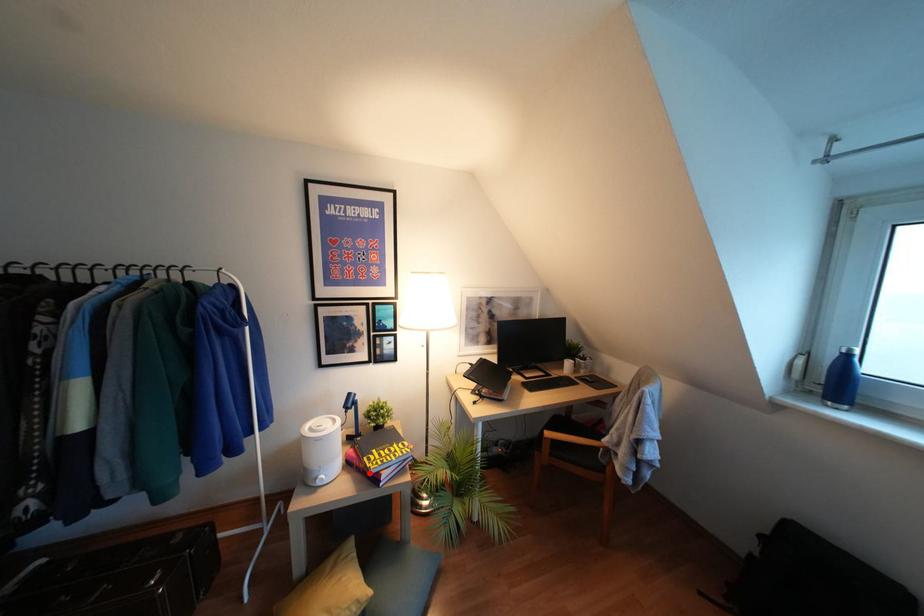
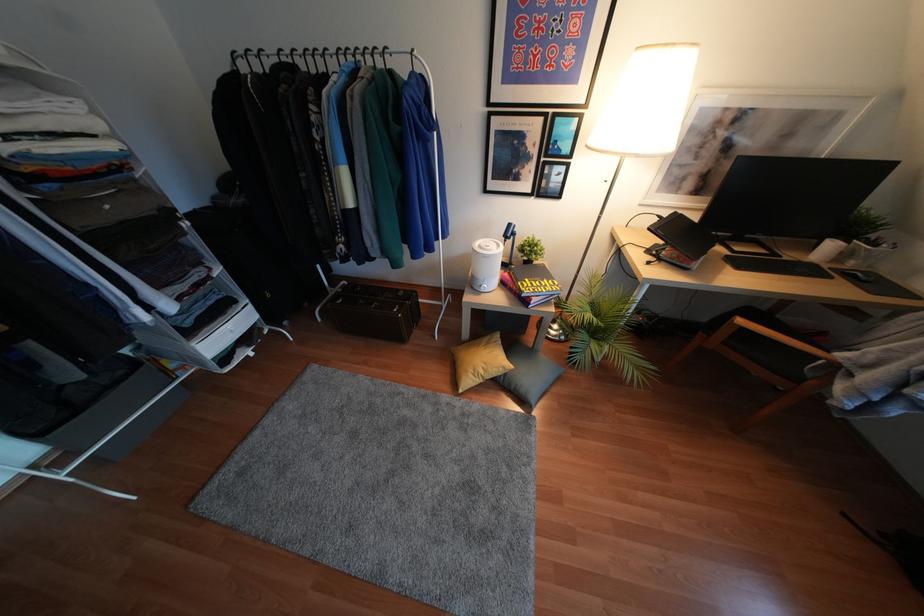
The point at the highlighted location is marked in the first image. Where is the corresponding point in the second image?

(523, 294)